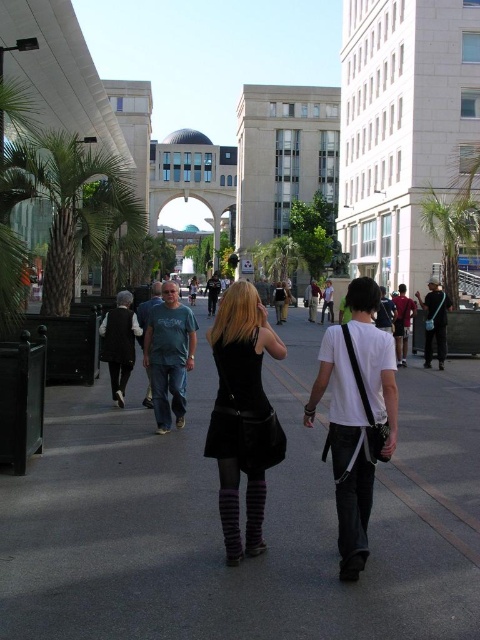
You are a fashion designer analyzing the urban scene. You notice the black leather skirt at center. Can you determine its exact position using the coordinate system provided in the description?

The black leather skirt at center is located at point [242,413] according to the coordinates provided in the Objects Description.

From the picture: You are a photographer standing in the urban scene and want to capture both the black leather skirt at center and the green leafy palm tree at right in your photo. Which object should you focus on first if you want to ensure both are in the frame?

The black leather skirt at center has a lesser height compared to the green leafy palm tree at right, so you should focus on the palm tree first to ensure both are visible in the frame.